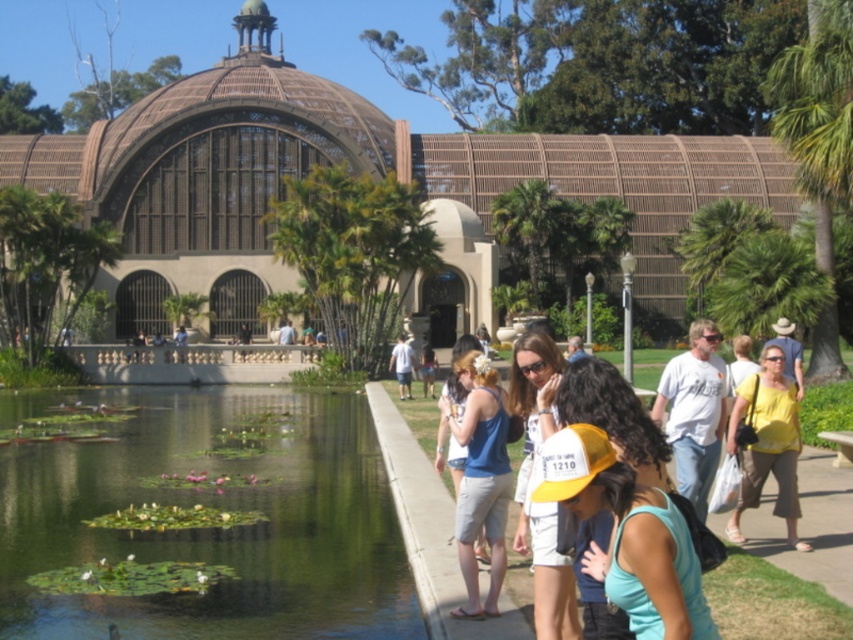
Which is below, yellow fabric cap at lower center or yellow cotton shirt at right?

yellow fabric cap at lower center is below.

Is yellow fabric cap at lower center further to the viewer compared to yellow cotton shirt at right?

That is False.

Which is in front, point (701, 614) or point (787, 476)?

Point (701, 614)

You are a GUI agent. You are given a task and a screenshot of the screen. Output one action in this format:
    pyautogui.click(x=<x>, y=<y>)
    Task: Click on the yellow fabric cap at lower center
    
    Given the screenshot: What is the action you would take?
    pyautogui.click(x=630, y=534)

Does point (187, 604) come farther from viewer compared to point (431, 384)?

No, it is in front of (431, 384).

Is green reflective water at lower left below matte white shirt at center?

Yes, green reflective water at lower left is below matte white shirt at center.

Is point (90, 484) positioned behind point (428, 380)?

That is False.

Identify the location of green reflective water at lower left. The height and width of the screenshot is (640, 853). (215, 509).

Does green reflective water at lower left appear on the right side of yellow fabric cap at center?

Incorrect, green reflective water at lower left is not on the right side of yellow fabric cap at center.

Who is higher up, green reflective water at lower left or yellow fabric cap at center?

Positioned higher is green reflective water at lower left.

Is point (316, 541) in front of point (540, 333)?

No.

The width and height of the screenshot is (853, 640). In order to click on green reflective water at lower left in this screenshot , I will do `click(215, 509)`.